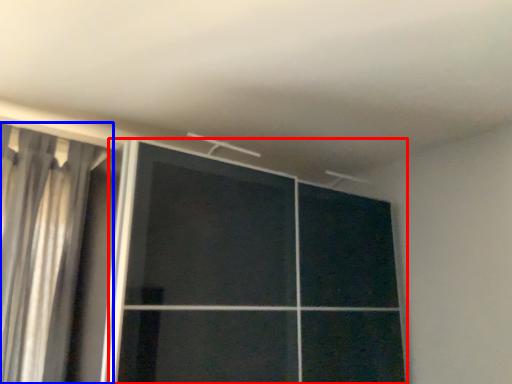
Question: Which point is closer to the camera, door (highlighted by a red box) or curtain (highlighted by a blue box)?

Choices:
 (A) door
 (B) curtain

Answer: (A)